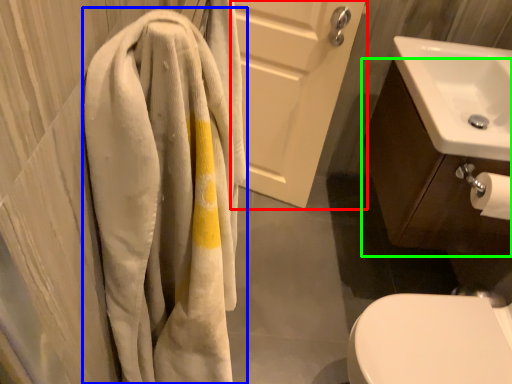
Question: Considering the real-world distances, which object is farthest from screen door (highlighted by a red box)? towel (highlighted by a blue box) or bathroom cabinet (highlighted by a green box)?

Choices:
 (A) towel
 (B) bathroom cabinet

Answer: (A)